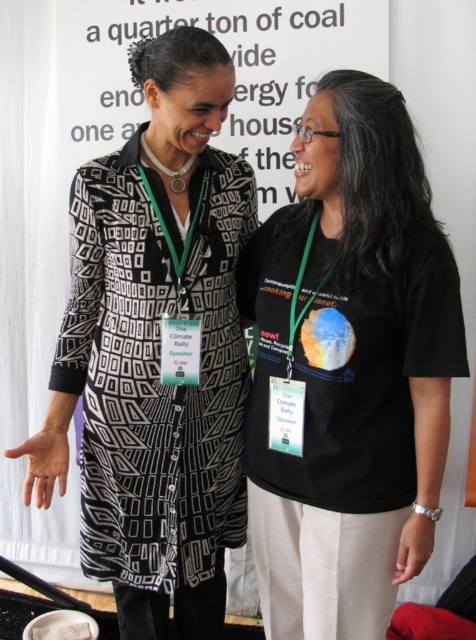
Between black matte t-shirt at center and black printed dress at left, which one appears on the left side from the viewer's perspective?

black printed dress at left is more to the left.

Which is in front, point (274, 456) or point (98, 372)?

Positioned in front is point (274, 456).

The height and width of the screenshot is (640, 476). I want to click on black matte t-shirt at center, so click(349, 368).